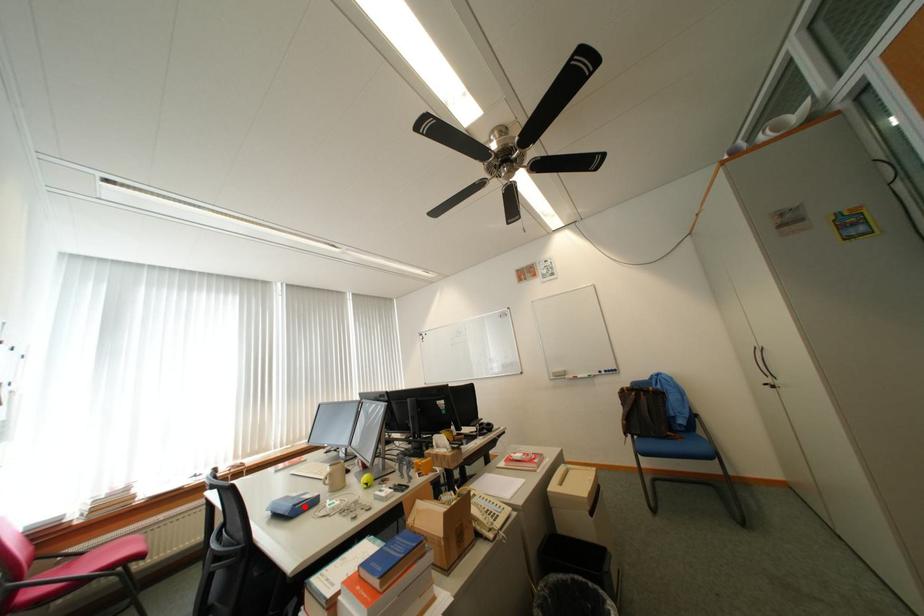
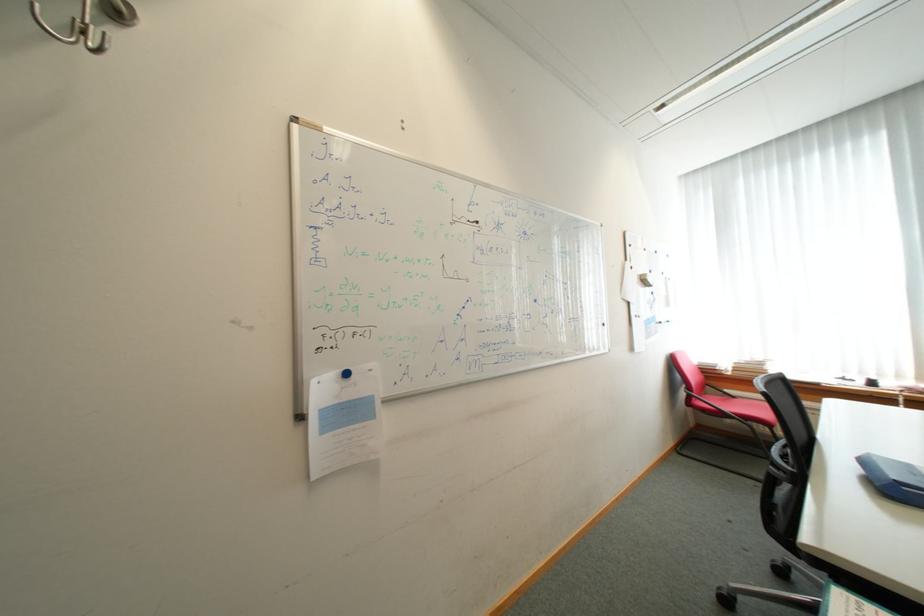
In the second image, find the point that corresponds to the highlighted location in the first image.

(912, 485)